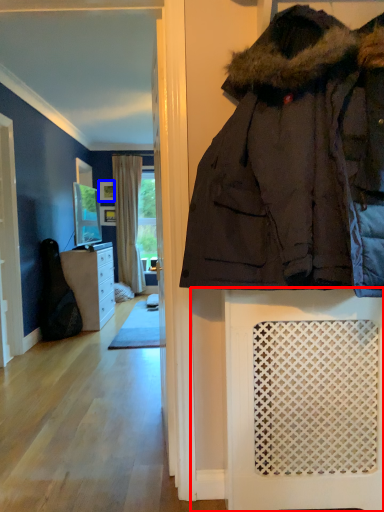
Question: Which object appears closest to the camera in this image, furniture (highlighted by a red box) or picture frame (highlighted by a blue box)?

Choices:
 (A) furniture
 (B) picture frame

Answer: (A)